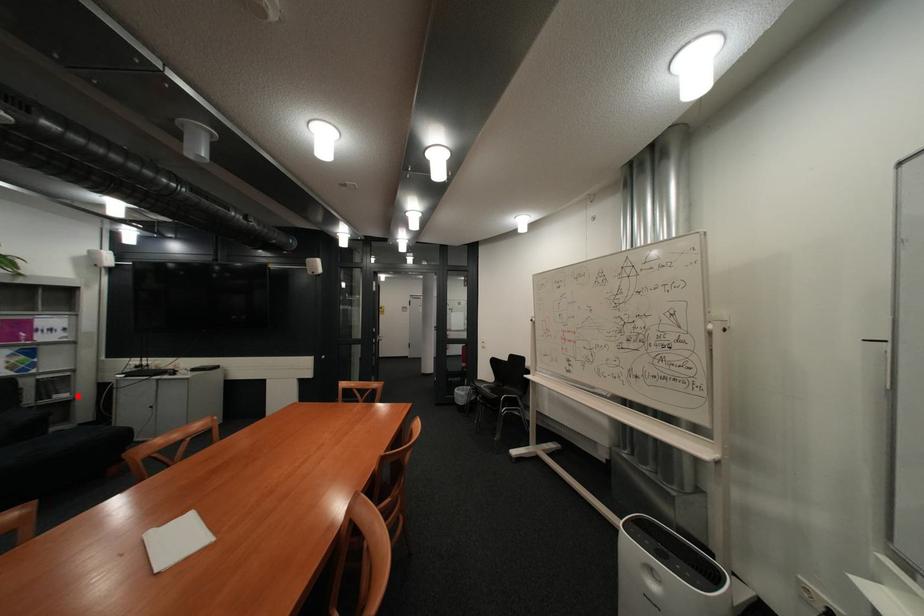
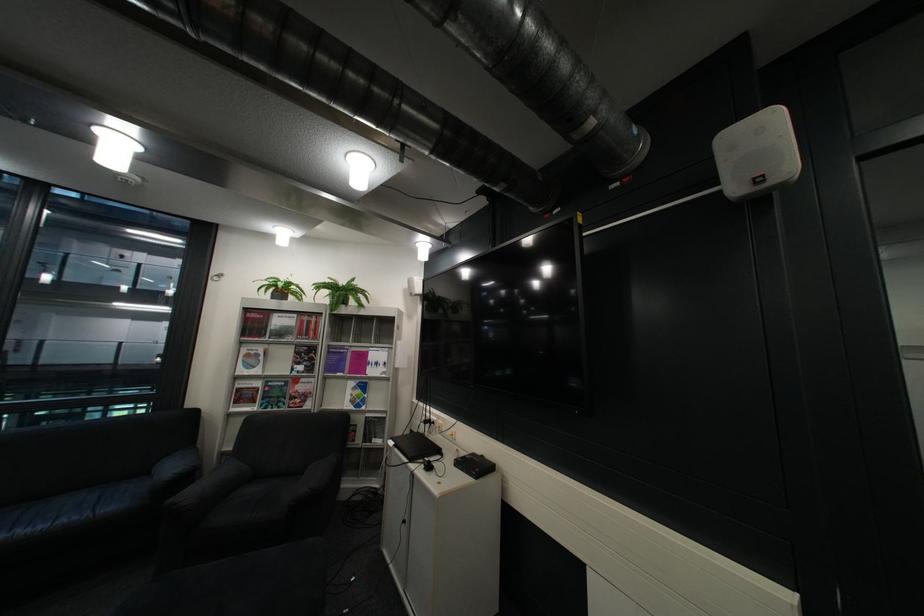
The point at the highlighted location is marked in the first image. Where is the corresponding point in the second image?

(393, 442)